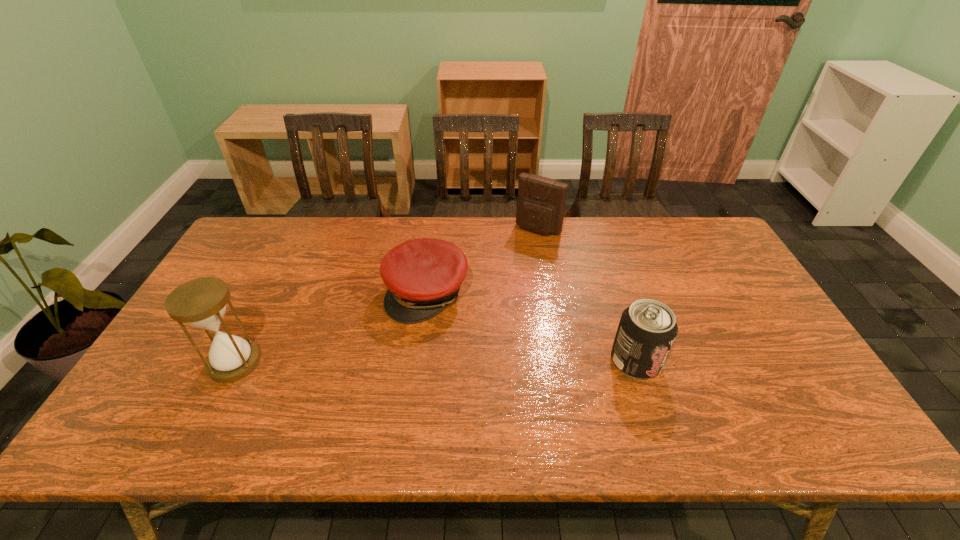
This screenshot has width=960, height=540. In order to click on free point located with an open flap on the third object from left to right in this screenshot , I will do `click(508, 268)`.

Where is `free spot located 0.200m with an open flap on the third object from left to right`? The width and height of the screenshot is (960, 540). free spot located 0.200m with an open flap on the third object from left to right is located at coordinates (505, 272).

You are a GUI agent. You are given a task and a screenshot of the screen. Output one action in this format:
    pyautogui.click(x=<x>, y=<y>)
    Task: Click on the free space located 0.050m with an open flap on the third object from left to right
    Image resolution: width=960 pixels, height=540 pixels.
    Given the screenshot: What is the action you would take?
    pyautogui.click(x=523, y=246)

Image resolution: width=960 pixels, height=540 pixels. I want to click on vacant space located 0.230m on the front of the third nearest object with an emblem, so click(x=372, y=391).

Where is `object that is at the far edge`? The image size is (960, 540). object that is at the far edge is located at coordinates (541, 202).

The width and height of the screenshot is (960, 540). I want to click on hourglass that is positioned at the near edge, so click(201, 302).

At what (x,y) coordinates should I click in order to perform the action: click on soda can located in the near edge section of the desktop. Please return your answer as a coordinate pair (x, y). This screenshot has width=960, height=540. Looking at the image, I should click on (647, 329).

Find the location of `object at the left edge`. object at the left edge is located at coordinates tap(201, 302).

At what (x,y) coordinates should I click in order to perform the action: click on object positioned at the near left corner. Please return your answer as a coordinate pair (x, y). Looking at the image, I should click on (201, 302).

Identify the location of vacant position at the far edge of the desktop. This screenshot has height=540, width=960. (512, 237).